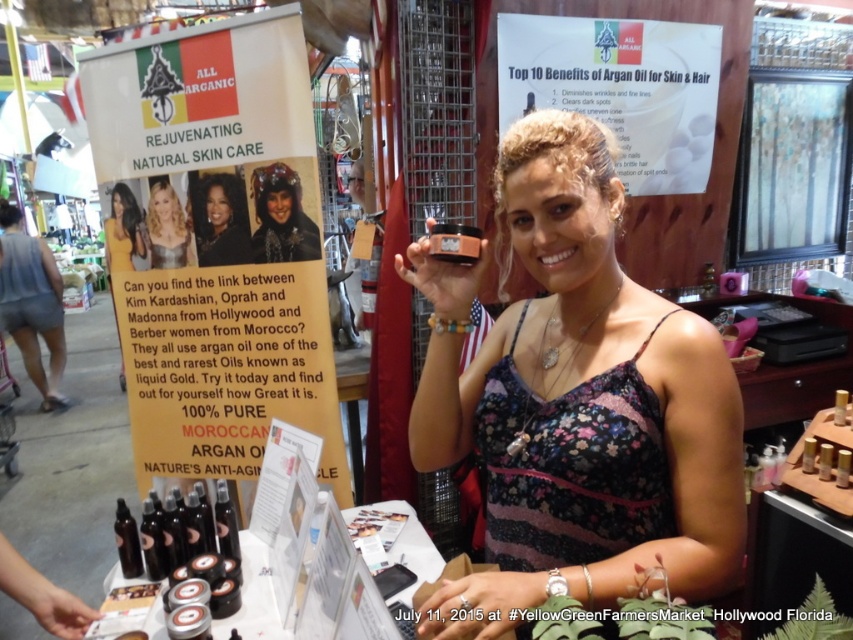
Question: Which object is positioned closest to the yellow fabric kimono at upper left?

Choices:
 (A) shiny silver dress at center
 (B) matte black helmet at center
 (C) matte black hair at center

Answer: (A)

Question: Does matte black helmet at center lie in front of yellow fabric kimono at upper left?

Choices:
 (A) no
 (B) yes

Answer: (B)

Question: Is shiny silver dress at center thinner than yellow fabric kimono at upper left?

Choices:
 (A) no
 (B) yes

Answer: (B)

Question: Which object appears farthest from the camera in this image?

Choices:
 (A) matte brown jar at center
 (B) yellow fabric kimono at upper left
 (C) shiny silver dress at center

Answer: (B)

Question: Among these points, which one is farthest from the camera?

Choices:
 (A) (589, 531)
 (B) (131, 218)

Answer: (B)

Question: Does matte brown jar at center have a greater width compared to matte black helmet at center?

Choices:
 (A) no
 (B) yes

Answer: (B)